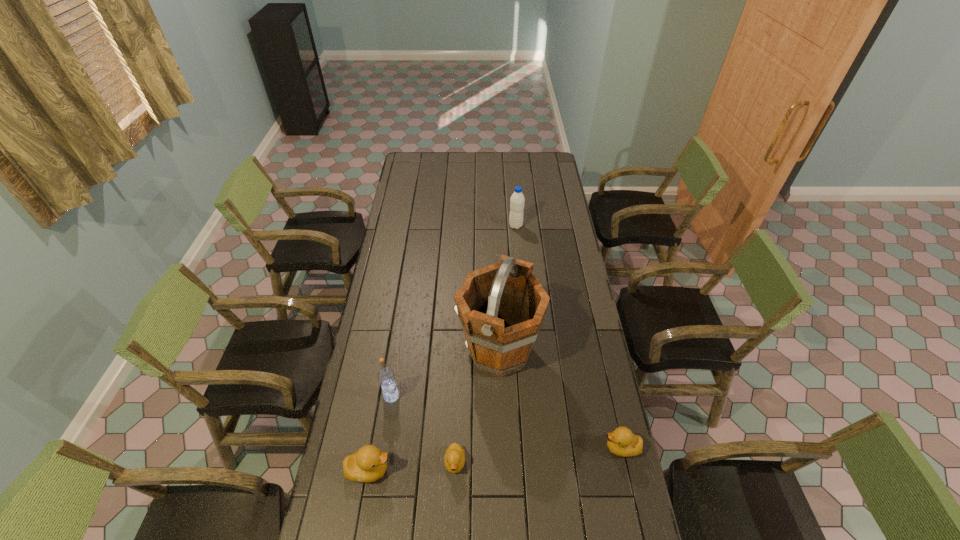
Where is `the fourth tallest object`? The height and width of the screenshot is (540, 960). the fourth tallest object is located at coordinates (367, 464).

Locate an element on the screen. This screenshot has height=540, width=960. the leftmost duckling is located at coordinates (367, 464).

You are a GUI agent. You are given a task and a screenshot of the screen. Output one action in this format:
    pyautogui.click(x=<x>, y=<y>)
    Task: Click on the shortest duckling
    
    Given the screenshot: What is the action you would take?
    coord(454,460)

Locate an element on the screen. the shortest object is located at coordinates (454, 460).

The height and width of the screenshot is (540, 960). Find the location of `the rightmost object`. the rightmost object is located at coordinates (622, 442).

Where is `the second tallest duckling`? The height and width of the screenshot is (540, 960). the second tallest duckling is located at coordinates (622, 442).

Locate an element on the screen. Image resolution: width=960 pixels, height=540 pixels. the farthest object is located at coordinates (517, 200).

Locate an element on the screen. The image size is (960, 540). the fourth nearest object is located at coordinates (386, 377).

The height and width of the screenshot is (540, 960). I want to click on bucket, so click(x=501, y=307).

Locate an element on the screen. The height and width of the screenshot is (540, 960). the second farthest object is located at coordinates (501, 307).